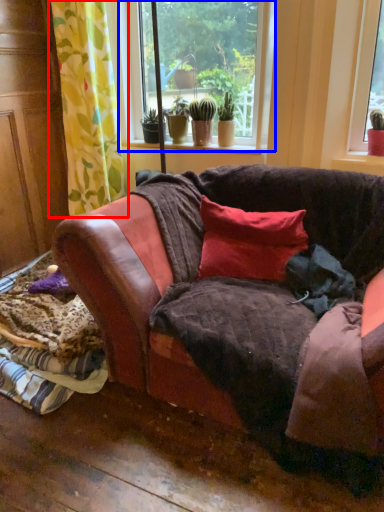
Question: Which object is further to the camera taking this photo, curtain (highlighted by a red box) or window (highlighted by a blue box)?

Choices:
 (A) curtain
 (B) window

Answer: (B)